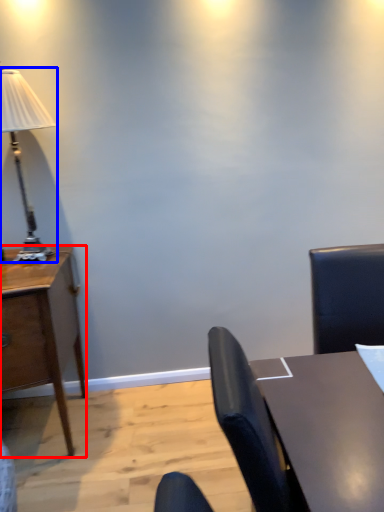
Question: Which point is further to the camera, desk (highlighted by a red box) or lamp (highlighted by a blue box)?

Choices:
 (A) desk
 (B) lamp

Answer: (B)